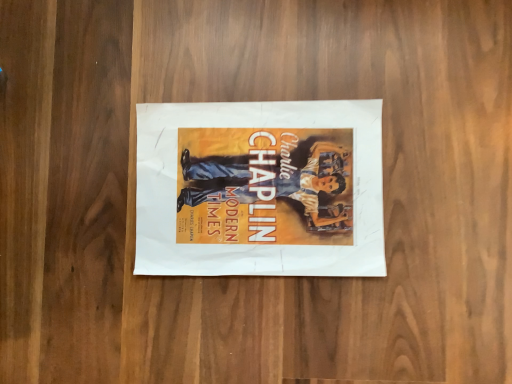
The image size is (512, 384). I want to click on vacant space situated above matte paper poster at center (from a real-world perspective), so click(x=264, y=186).